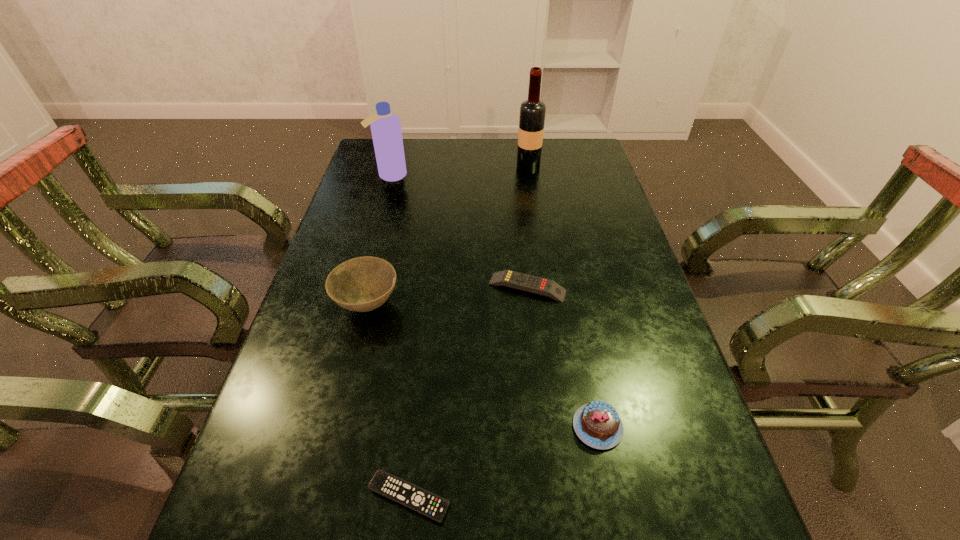
At what (x,y) coordinates should I click in order to perform the action: click on vacant space located on the front of the fifth shortest object. Please return your answer as a coordinate pair (x, y). Looking at the image, I should click on (371, 244).

Find the location of a particular element. vacant space located 0.300m on the right of the bowl is located at coordinates (525, 304).

This screenshot has width=960, height=540. I want to click on free space located 0.170m on the left of the second nearest object, so click(x=483, y=427).

The height and width of the screenshot is (540, 960). What are the coordinates of `vacant space located 0.070m on the back of the taller remote control` in the screenshot? It's located at (524, 255).

Locate an element on the screen. The image size is (960, 540). blank area located 0.160m on the right of the shorter remote control is located at coordinates (545, 497).

The height and width of the screenshot is (540, 960). What are the coordinates of `wine bottle that is at the far edge` in the screenshot? It's located at point(532,111).

Where is `shampoo that is at the far edge`? Image resolution: width=960 pixels, height=540 pixels. shampoo that is at the far edge is located at coordinates (385, 126).

This screenshot has width=960, height=540. Identify the location of shampoo that is at the left edge. (385, 126).

Locate an element on the screen. Image resolution: width=960 pixels, height=540 pixels. bowl positioned at the left edge is located at coordinates (362, 284).

You are a GUI agent. You are given a task and a screenshot of the screen. Output one action in this format:
    pyautogui.click(x=<x>, y=<y>)
    Task: Click on the object that is at the right edge
    Image resolution: width=960 pixels, height=540 pixels.
    Given the screenshot: What is the action you would take?
    pyautogui.click(x=597, y=424)